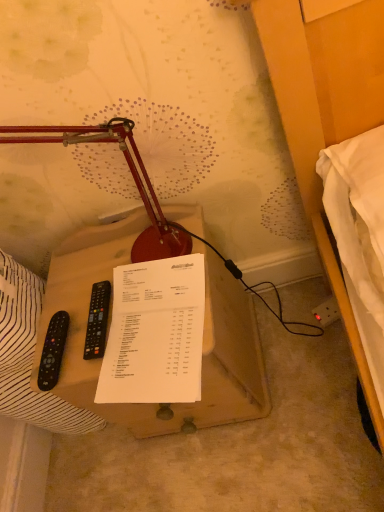
Question: Can you confirm if white paper at center is smaller than black plastic remote control at left, which is the 1th remote control in right-to-left order?

Choices:
 (A) yes
 (B) no

Answer: (B)

Question: Is white paper at center to the right of black plastic remote control at left, acting as the 2th remote control starting from the left, from the viewer's perspective?

Choices:
 (A) no
 (B) yes

Answer: (B)

Question: Would you say white paper at center is a long distance from black plastic remote control at left, acting as the 2th remote control starting from the left?

Choices:
 (A) yes
 (B) no

Answer: (B)

Question: Is white paper at center facing towards black plastic remote control at left, which is the 1th remote control in right-to-left order?

Choices:
 (A) no
 (B) yes

Answer: (A)

Question: From a real-world perspective, is white paper at center located higher than black plastic remote control at left, acting as the 2th remote control starting from the left?

Choices:
 (A) no
 (B) yes

Answer: (A)

Question: From a real-world perspective, is white paper at center below black plastic remote control at left, which is the 1th remote control in right-to-left order?

Choices:
 (A) no
 (B) yes

Answer: (B)

Question: Is black plastic remote control at left, acting as the 2th remote control starting from the left, turned away from matte red lamp at center?

Choices:
 (A) no
 (B) yes

Answer: (B)

Question: Is black plastic remote control at left, acting as the 2th remote control starting from the left, not near matte red lamp at center?

Choices:
 (A) yes
 (B) no

Answer: (B)

Question: Does black plastic remote control at left, which is the 1th remote control in right-to-left order, contain matte red lamp at center?

Choices:
 (A) no
 (B) yes

Answer: (A)

Question: From the image's perspective, is black plastic remote control at left, acting as the 2th remote control starting from the left, above matte red lamp at center?

Choices:
 (A) no
 (B) yes

Answer: (A)

Question: Can you confirm if black plastic remote control at left, which is the 1th remote control in right-to-left order, is positioned to the right of matte red lamp at center?

Choices:
 (A) no
 (B) yes

Answer: (B)

Question: Considering the relative sizes of black plastic remote control at left, which is the 1th remote control in right-to-left order, and matte red lamp at center in the image provided, is black plastic remote control at left, which is the 1th remote control in right-to-left order, wider than matte red lamp at center?

Choices:
 (A) no
 (B) yes

Answer: (B)

Question: From the image's perspective, does black plastic remote at left, which is the 1th remote control in left-to-right order, appear lower than black plastic remote control at left, which is the 1th remote control in right-to-left order?

Choices:
 (A) no
 (B) yes

Answer: (B)